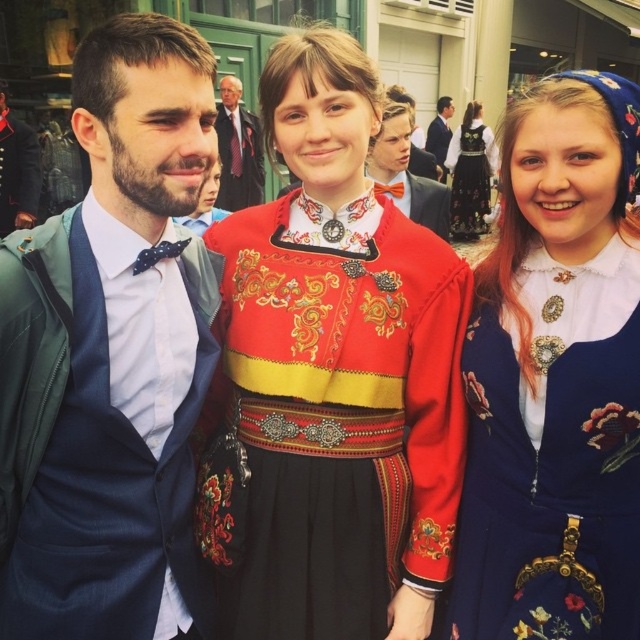
Question: Which object is the closest to the embroidered silk dress at center?

Choices:
 (A) matte black bow tie at center
 (B) dark blue suit at upper center

Answer: (A)

Question: Where is embroidered velvet dress at center located in relation to matte black bow tie at center in the image?

Choices:
 (A) below
 (B) above

Answer: (B)

Question: Which of the following is the closest to the observer?

Choices:
 (A) matte black suit at upper center
 (B) matte blue suit at left
 (C) matte black bow tie at center
 (D) embroidered fabric dress at center

Answer: (B)

Question: Estimate the real-world distances between objects in this image. Which object is closer to the embroidered silk dress at center?

Choices:
 (A) matte black suit at upper center
 (B) embroidered fabric dress at center
 (C) velvet military uniform at center
 (D) matte blue suit at left

Answer: (D)

Question: Is embroidered silk dress at center thinner than embroidered fabric dress at center?

Choices:
 (A) yes
 (B) no

Answer: (B)

Question: Considering the relative positions of embroidered silk dress at center and dark blue suit at upper center in the image provided, where is embroidered silk dress at center located with respect to dark blue suit at upper center?

Choices:
 (A) below
 (B) above

Answer: (A)